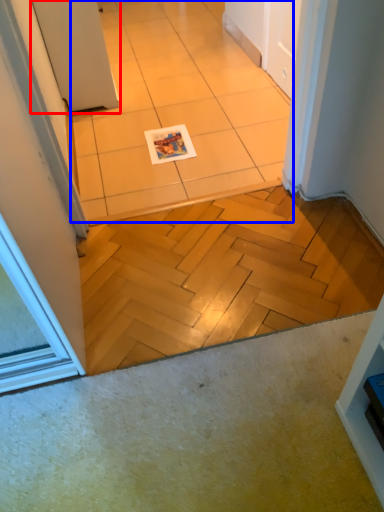
Question: Which object appears closest to the camera in this image, door (highlighted by a red box) or ceramic tile (highlighted by a blue box)?

Choices:
 (A) door
 (B) ceramic tile

Answer: (B)